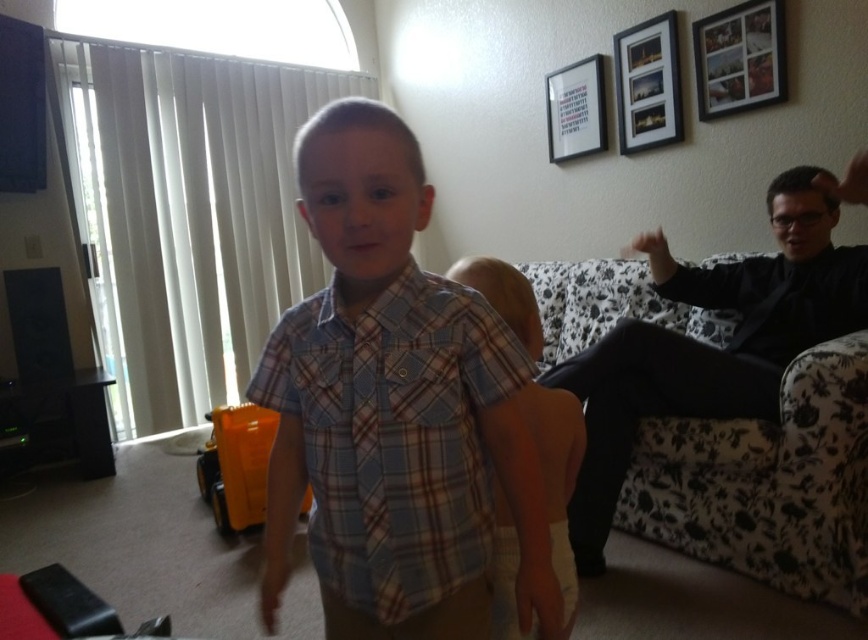
Question: Observing the image, what is the correct spatial positioning of plaid fabric shirt at center in reference to wooden picture frame at upper right?

Choices:
 (A) left
 (B) right

Answer: (A)

Question: Can you confirm if black smooth shirt at right is positioned to the left of wooden photo frame at upper right?

Choices:
 (A) yes
 (B) no

Answer: (A)

Question: Does wooden photo frame at upper right appear over white matte picture frame at upper center?

Choices:
 (A) yes
 (B) no

Answer: (B)

Question: Estimate the real-world distances between objects in this image. Which object is farther from the wooden picture frame at upper right?

Choices:
 (A) plaid cotton shirt at center
 (B) plaid fabric shirt at center
 (C) black smooth shirt at right
 (D) white matte picture frame at upper center

Answer: (A)

Question: Among these objects, which one is farthest from the camera?

Choices:
 (A) wooden photo frame at upper right
 (B) white matte picture frame at upper center
 (C) plaid cotton shirt at center

Answer: (B)

Question: Which object appears farthest from the camera in this image?

Choices:
 (A) wooden photo frame at upper right
 (B) wooden picture frame at upper right
 (C) black smooth shirt at right

Answer: (B)